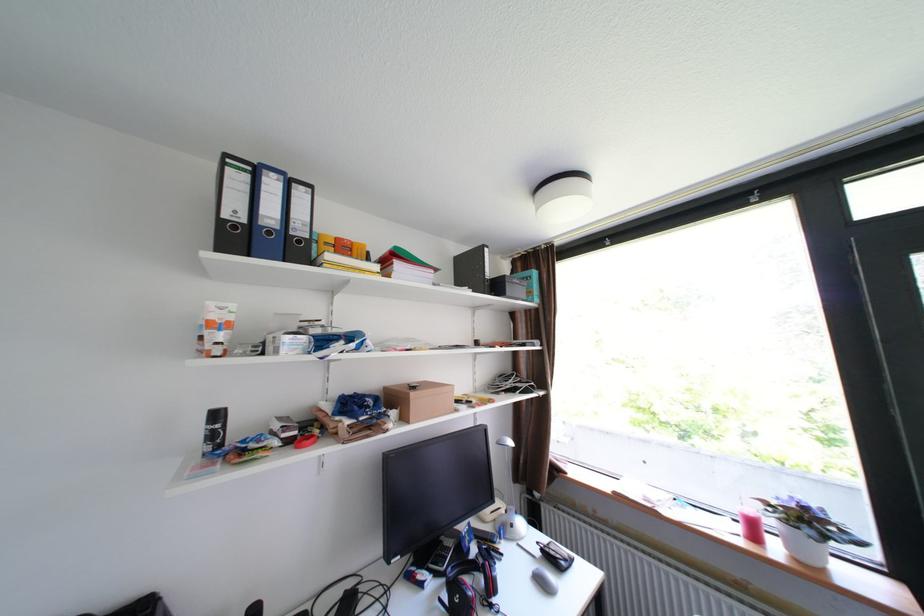
Where would you press the black calculator? Please return your answer as a coordinate pair (x, y).

(444, 553)